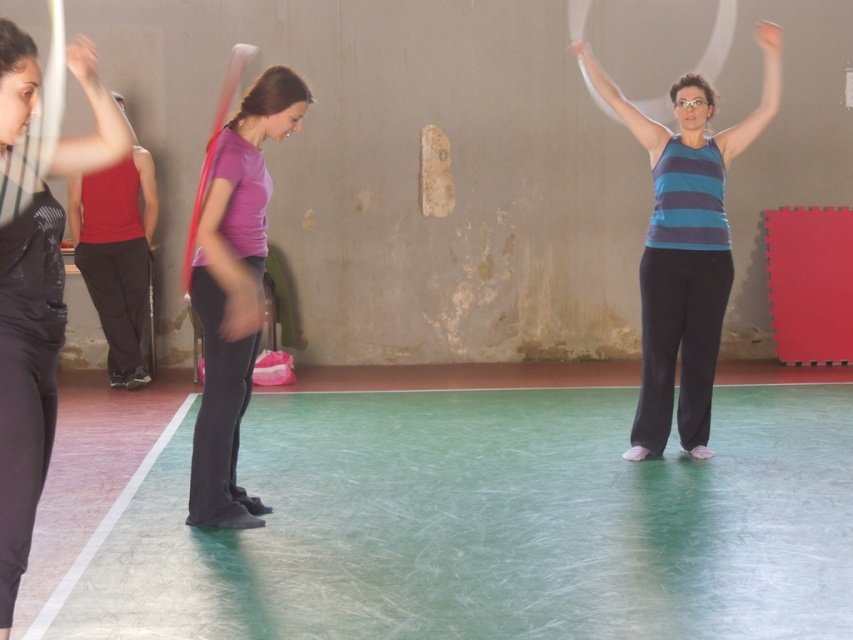
Does striped tank top at center lie in front of matte red tank top at left?

Yes, striped tank top at center is in front of matte red tank top at left.

Who is lower down, striped tank top at center or matte red tank top at left?

matte red tank top at left is lower down.

Identify the location of striped tank top at center. Image resolution: width=853 pixels, height=640 pixels. (685, 246).

You are a GUI agent. You are given a task and a screenshot of the screen. Output one action in this format:
    pyautogui.click(x=<x>, y=<y>)
    Task: Click on the striped tank top at center
    This screenshot has height=640, width=853.
    Given the screenshot: What is the action you would take?
    pyautogui.click(x=685, y=246)

Does matte black pants at left appear on the right side of matte red tank top at left?

Indeed, matte black pants at left is positioned on the right side of matte red tank top at left.

Between point (94, 67) and point (134, 284), which one is positioned in front?

Point (94, 67) is more forward.

Locate an element on the screen. This screenshot has height=640, width=853. matte black pants at left is located at coordinates [26, 378].

Find the location of a particular element. matte black pants at left is located at coordinates (26, 378).

Is matte black pants at left smaller than purple matte shirt at center?

Correct, matte black pants at left occupies less space than purple matte shirt at center.

Where is `matte black pants at left`? matte black pants at left is located at coordinates tap(26, 378).